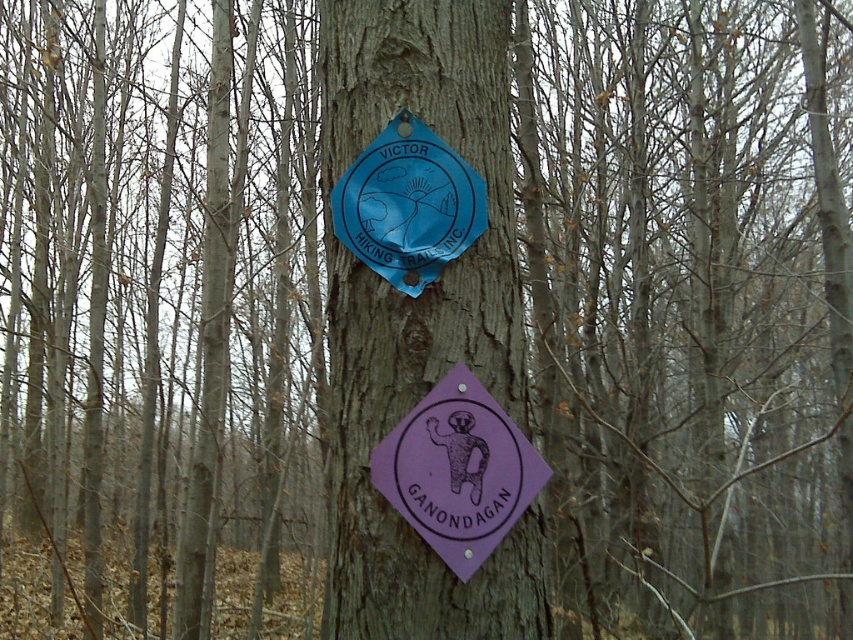
In the scene shown: You are a hiker who wants to read both the purple matte sign at center and the blue plastic badge at center on the tree trunk. Which sign should you look to your left to see?

The purple matte sign at center is positioned on the right side of the blue plastic badge at center. Therefore, to see the blue plastic badge at center, you should look to your left since it is on the left side relative to the purple matte sign at center.

In the scene shown: You are a hiker trying to read both the brown rough tree trunk at center and the purple matte sign at center. Which one do you need to look up at first?

The brown rough tree trunk at center is located above the purple matte sign at center, so you need to look up at the brown rough tree trunk at center first before looking down at the purple matte sign at center.

Looking at this image, you are a hiker trying to read the blue plastic badge at center attached to the brown rough tree trunk at center. Can you see the entire badge clearly?

The brown rough tree trunk at center is in front of the blue plastic badge at center, so the tree trunk may block part of the badge, making it difficult to see the entire badge clearly.